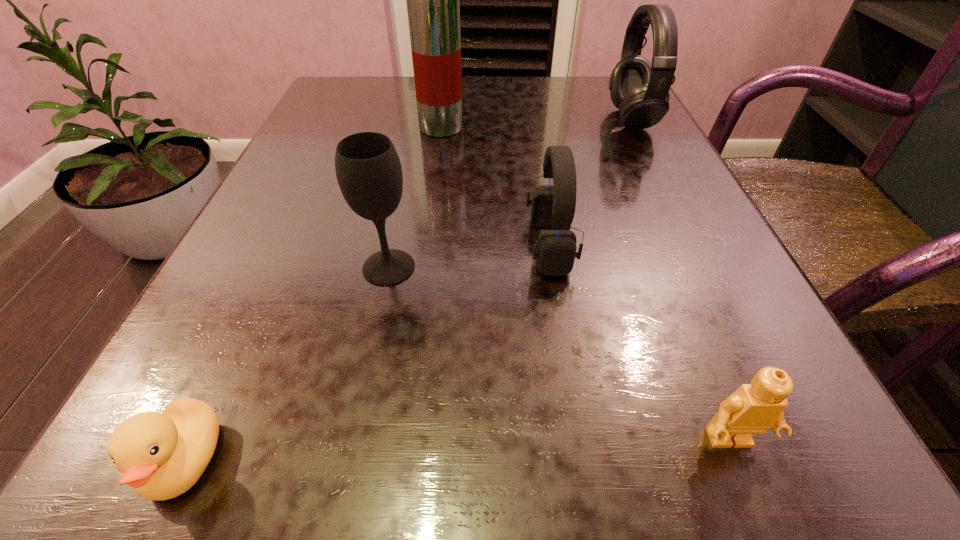
At what (x,y) coordinates should I click in order to perform the action: click on free point at the right edge. Please return your answer as a coordinate pair (x, y). This screenshot has height=540, width=960. Looking at the image, I should click on (643, 193).

In the image, there is a desktop. Where is `vacant space at the far left corner`? vacant space at the far left corner is located at coordinates (394, 91).

Locate an element on the screen. The width and height of the screenshot is (960, 540). vacant position at the far right corner of the desktop is located at coordinates (588, 94).

Where is `free space between the left headset and the wineglass`? Image resolution: width=960 pixels, height=540 pixels. free space between the left headset and the wineglass is located at coordinates (469, 256).

Where is `vacant space that's between the wineglass and the farther headset`? The height and width of the screenshot is (540, 960). vacant space that's between the wineglass and the farther headset is located at coordinates [510, 193].

Find the location of a particular element. This screenshot has height=540, width=960. vacant point located between the third shortest object and the wineglass is located at coordinates 469,256.

Find the location of `free space between the taller headset and the leftmost object`. free space between the taller headset and the leftmost object is located at coordinates (408, 290).

At what (x,y) coordinates should I click in order to perform the action: click on vacant region between the wineglass and the shorter headset. Please return your answer as a coordinate pair (x, y). The width and height of the screenshot is (960, 540). Looking at the image, I should click on (469, 256).

Find the location of a particular element. free space that is in between the fifth tallest object and the leftmost object is located at coordinates (457, 451).

At what (x,y) coordinates should I click in order to perform the action: click on free space between the tallest object and the Lego. Please return your answer as a coordinate pair (x, y). Looking at the image, I should click on (586, 285).